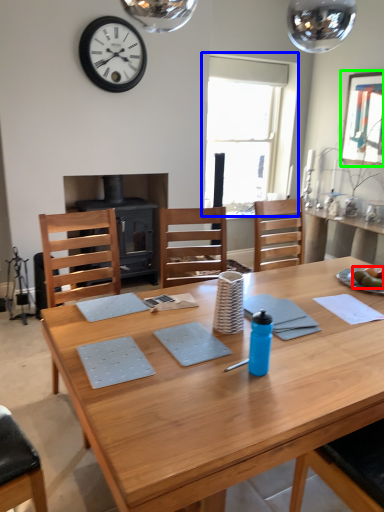
Question: Which object is positioned closest to food (highlighted by a red box)? Select from window (highlighted by a blue box) and picture frame (highlighted by a green box).

Choices:
 (A) window
 (B) picture frame

Answer: (B)